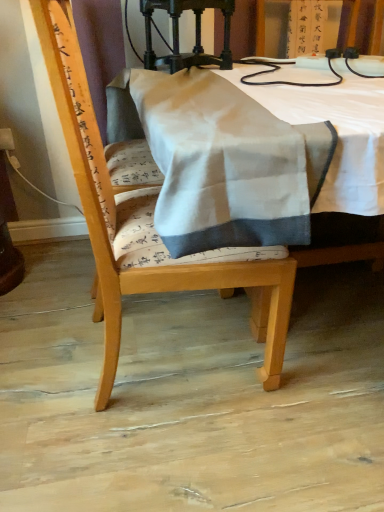
Question: Is polished dark wood lamp at upper center in front of or behind wooden chair at center in the image?

Choices:
 (A) behind
 (B) front

Answer: (A)

Question: Would you say polished dark wood lamp at upper center is inside or outside wooden chair at center?

Choices:
 (A) inside
 (B) outside

Answer: (B)

Question: Estimate the real-world distances between objects in this image. Which object is farther from the polished dark wood lamp at upper center?

Choices:
 (A) wooden chair at center
 (B) white fabric at center

Answer: (A)

Question: Considering the real-world distances, which object is closest to the white fabric at center?

Choices:
 (A) wooden chair at center
 (B) polished dark wood lamp at upper center

Answer: (B)